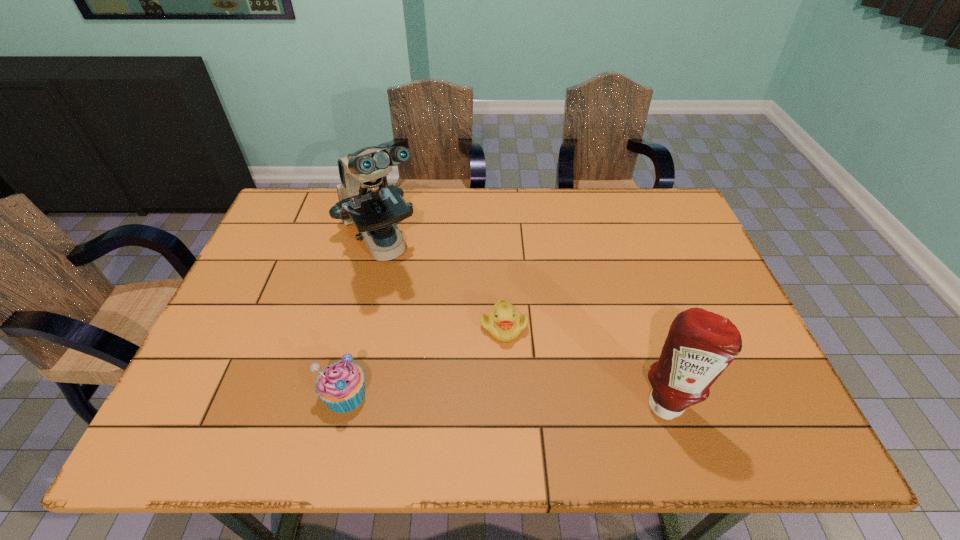
Locate an element on the screen. The height and width of the screenshot is (540, 960). vacant area at the far left corner of the desktop is located at coordinates (317, 190).

This screenshot has width=960, height=540. Find the location of `blank space at the near left corner`. blank space at the near left corner is located at coordinates (231, 403).

Find the location of a particular element. Image resolution: width=960 pixels, height=540 pixels. vacant space at the near right corner of the desktop is located at coordinates pyautogui.click(x=747, y=376).

I want to click on vacant space that is in between the third tallest object and the rightmost object, so click(505, 398).

The image size is (960, 540). I want to click on vacant area that lies between the third nearest object and the microscope, so click(443, 285).

Locate an element on the screen. The width and height of the screenshot is (960, 540). empty space between the condiment and the second shortest object is located at coordinates (505, 398).

At what (x,y) coordinates should I click in order to perform the action: click on empty space that is in between the shortest object and the farthest object. Please return your answer as a coordinate pair (x, y). The image size is (960, 540). Looking at the image, I should click on (443, 285).

You are a GUI agent. You are given a task and a screenshot of the screen. Output one action in this format:
    pyautogui.click(x=<x>, y=<y>)
    Task: Click on the vacant region between the shortest object and the rightmost object
    The image size is (960, 540).
    Given the screenshot: What is the action you would take?
    pyautogui.click(x=585, y=363)

The height and width of the screenshot is (540, 960). I want to click on vacant point located between the third object from left to right and the muffin, so click(x=424, y=360).

Locate an element on the screen. The height and width of the screenshot is (540, 960). free space between the muffin and the duckling is located at coordinates (424, 360).